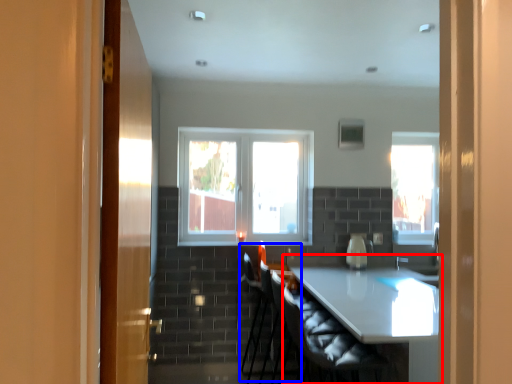
Question: Which object appears farthest to the camera in this image, table (highlighted by a red box) or armchair (highlighted by a blue box)?

Choices:
 (A) table
 (B) armchair

Answer: (B)